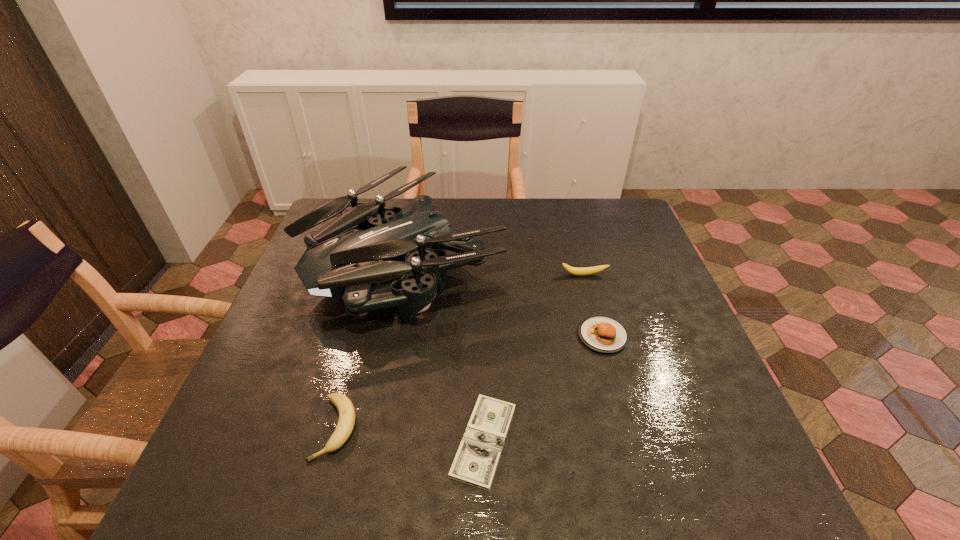
Where is `vacant region between the food and the drone`? This screenshot has height=540, width=960. vacant region between the food and the drone is located at coordinates coord(504,300).

Where is `free area in between the drone and the food`? Image resolution: width=960 pixels, height=540 pixels. free area in between the drone and the food is located at coordinates (504, 300).

This screenshot has width=960, height=540. In order to click on vacant point located between the shortest object and the food in this screenshot , I will do `click(543, 388)`.

Locate an element on the screen. This screenshot has height=540, width=960. free space between the shortest object and the taller banana is located at coordinates (534, 358).

Where is `the fourth closest object to the farther banana`? the fourth closest object to the farther banana is located at coordinates (346, 410).

Select which object appears as the closest to the drone. Please provide its 2D coordinates. Your answer should be formatted as a tuple, i.e. [(x, y)], where the tuple contains the x and y coordinates of a point satisfying the conditions above.

[(584, 271)]

The image size is (960, 540). In order to click on free region that satisfies the following two spatial constraints: 1. on the upward curve of the food; 2. on the left side of the right banana in this screenshot , I will do `click(600, 336)`.

The width and height of the screenshot is (960, 540). What are the coordinates of `vacant area in the image that satisfies the following two spatial constraints: 1. at the stem of the dollar; 2. on the left side of the fourth tallest object` in the screenshot? It's located at (332, 441).